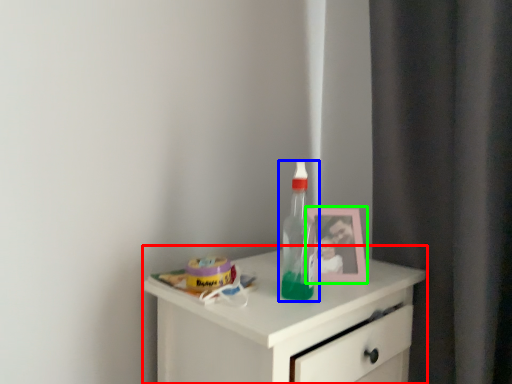
Question: Which is nearer to the chest of drawers (highlighted by a red box)? bottle (highlighted by a blue box) or picture frame (highlighted by a green box).

Choices:
 (A) bottle
 (B) picture frame

Answer: (A)